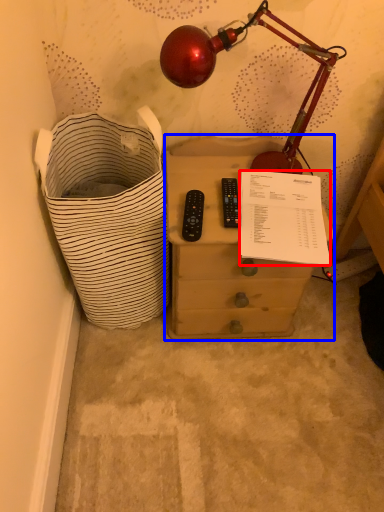
Question: Which object is further to the camera taking this photo, writing (highlighted by a red box) or nightstand (highlighted by a blue box)?

Choices:
 (A) writing
 (B) nightstand

Answer: (B)